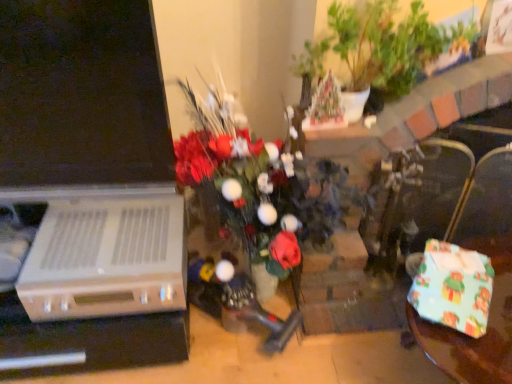
Question: Is green leafy plant at upper center far away from wrapping paper gift at lower right?

Choices:
 (A) yes
 (B) no

Answer: (B)

Question: From the image's perspective, would you say green leafy plant at upper center is shown under wrapping paper gift at lower right?

Choices:
 (A) no
 (B) yes

Answer: (A)

Question: Is green leafy plant at upper center turned away from wrapping paper gift at lower right?

Choices:
 (A) yes
 (B) no

Answer: (B)

Question: From a real-world perspective, is green leafy plant at upper center beneath wrapping paper gift at lower right?

Choices:
 (A) yes
 (B) no

Answer: (B)

Question: Is green leafy plant at upper center not within wrapping paper gift at lower right?

Choices:
 (A) yes
 (B) no

Answer: (A)

Question: Is green leafy plant at upper center next to wrapping paper gift at lower right and touching it?

Choices:
 (A) yes
 (B) no

Answer: (B)

Question: Would you say green leafy plant at upper center is outside dark brown leather armchair at right?

Choices:
 (A) yes
 (B) no

Answer: (A)

Question: From the image's perspective, does green leafy plant at upper center appear lower than dark brown leather armchair at right?

Choices:
 (A) no
 (B) yes

Answer: (A)

Question: Considering the relative sizes of green leafy plant at upper center and dark brown leather armchair at right in the image provided, is green leafy plant at upper center smaller than dark brown leather armchair at right?

Choices:
 (A) no
 (B) yes

Answer: (A)

Question: Is the depth of green leafy plant at upper center less than that of dark brown leather armchair at right?

Choices:
 (A) no
 (B) yes

Answer: (B)

Question: From the image's perspective, would you say green leafy plant at upper center is positioned over dark brown leather armchair at right?

Choices:
 (A) yes
 (B) no

Answer: (A)

Question: Considering the relative positions of green leafy plant at upper center and dark brown leather armchair at right in the image provided, is green leafy plant at upper center to the right of dark brown leather armchair at right from the viewer's perspective?

Choices:
 (A) no
 (B) yes

Answer: (A)

Question: Is wrapping paper gift at lower right oriented away from dark brown leather armchair at right?

Choices:
 (A) no
 (B) yes

Answer: (B)